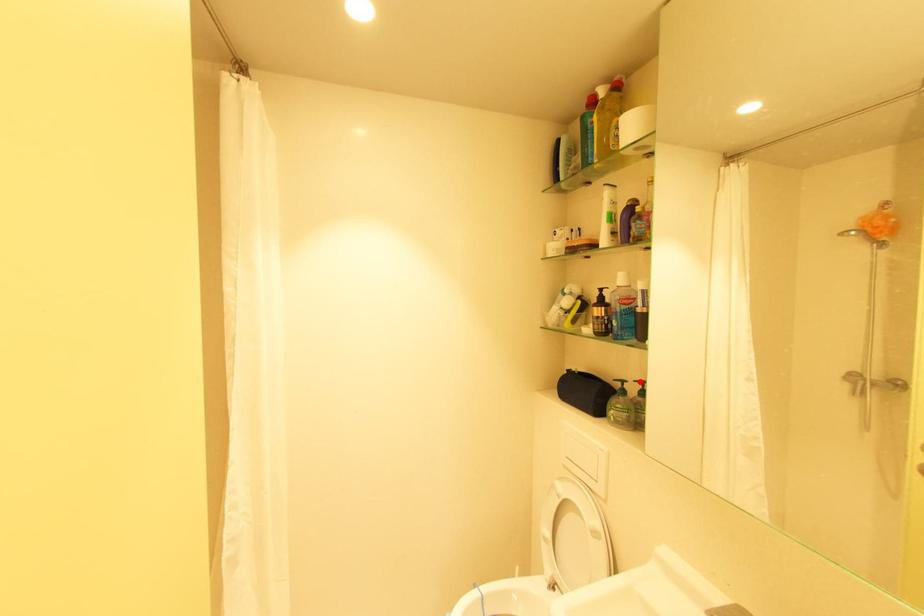
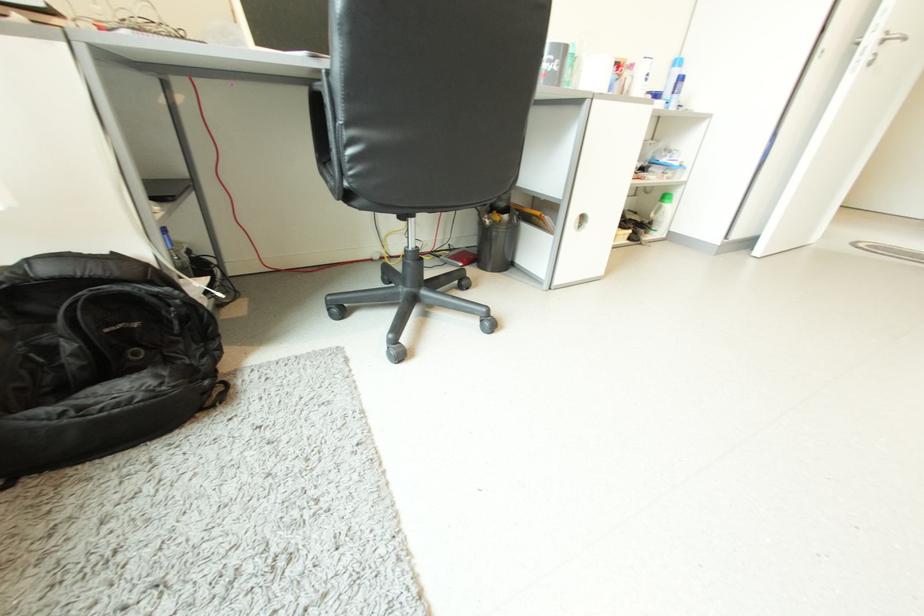
Question: I am providing you with two images of the same scene from different viewpoints. A red point is marked on the first image. Is the red point's position out of view in image 2?

Choices:
 (A) Yes
 (B) No

Answer: (A)